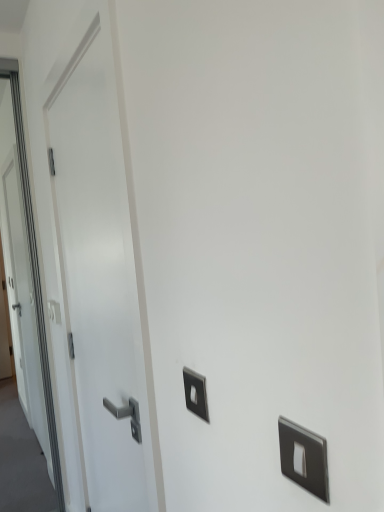
Question: Considering the relative positions of satin silver switch at left, acting as the 2th light switch starting from the front, and white glossy door at left in the image provided, is satin silver switch at left, acting as the 2th light switch starting from the front, to the right of white glossy door at left from the viewer's perspective?

Choices:
 (A) yes
 (B) no

Answer: (B)

Question: Does satin silver switch at left, acting as the first light switch starting from the left, have a greater height compared to white glossy door at left?

Choices:
 (A) yes
 (B) no

Answer: (B)

Question: From the image's perspective, is satin silver switch at left, which appears as the first light switch when viewed from the back, below white glossy door at left?

Choices:
 (A) yes
 (B) no

Answer: (A)

Question: Considering the relative sizes of satin silver switch at left, positioned as the 2th light switch in right-to-left order, and white glossy door at left in the image provided, is satin silver switch at left, positioned as the 2th light switch in right-to-left order, shorter than white glossy door at left?

Choices:
 (A) no
 (B) yes

Answer: (B)

Question: Could you tell me if satin silver switch at left, positioned as the 2th light switch in right-to-left order, is facing white glossy door at left?

Choices:
 (A) yes
 (B) no

Answer: (B)

Question: Considering the positions of satin silver switch at center, the 2th light switch in the back-to-front sequence, and satin silver switch at left, acting as the first light switch starting from the left, in the image, is satin silver switch at center, the 2th light switch in the back-to-front sequence, taller or shorter than satin silver switch at left, acting as the first light switch starting from the left,?

Choices:
 (A) tall
 (B) short

Answer: (B)

Question: Is point (193, 394) positioned closer to the camera than point (56, 321)?

Choices:
 (A) farther
 (B) closer

Answer: (B)

Question: Visually, is satin silver switch at center, the 2th light switch in the back-to-front sequence, positioned to the left or to the right of satin silver switch at left, acting as the first light switch starting from the left?

Choices:
 (A) left
 (B) right

Answer: (B)

Question: From a real-world perspective, is satin silver switch at center, marked as the first light switch in a front-to-back arrangement, above or below satin silver switch at left, acting as the 2th light switch starting from the front?

Choices:
 (A) above
 (B) below

Answer: (A)

Question: Is white glossy door at left bigger or smaller than satin silver switch at left, acting as the 2th light switch starting from the front?

Choices:
 (A) small
 (B) big

Answer: (B)

Question: In terms of height, does white glossy door at left look taller or shorter compared to satin silver switch at left, acting as the 2th light switch starting from the front?

Choices:
 (A) short
 (B) tall

Answer: (B)

Question: Looking at their shapes, would you say white glossy door at left is wider or thinner than satin silver switch at left, acting as the 2th light switch starting from the front?

Choices:
 (A) wide
 (B) thin

Answer: (A)

Question: From a real-world perspective, is white glossy door at left above or below satin silver switch at left, acting as the 2th light switch starting from the front?

Choices:
 (A) above
 (B) below

Answer: (A)

Question: Choose the correct answer: Is satin silver switch at left, which appears as the first light switch when viewed from the back, inside white glossy door at left or outside it?

Choices:
 (A) outside
 (B) inside

Answer: (A)

Question: Considering the positions of satin silver switch at left, acting as the 2th light switch starting from the front, and white glossy door at left in the image, is satin silver switch at left, acting as the 2th light switch starting from the front, bigger or smaller than white glossy door at left?

Choices:
 (A) small
 (B) big

Answer: (A)